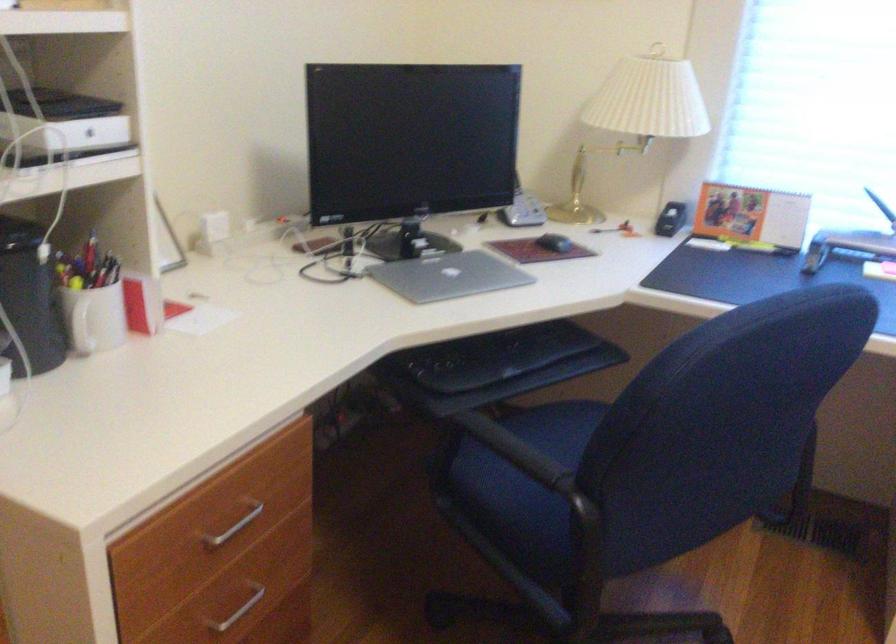
The image size is (896, 644). I want to click on black chair armrest, so click(x=513, y=450).